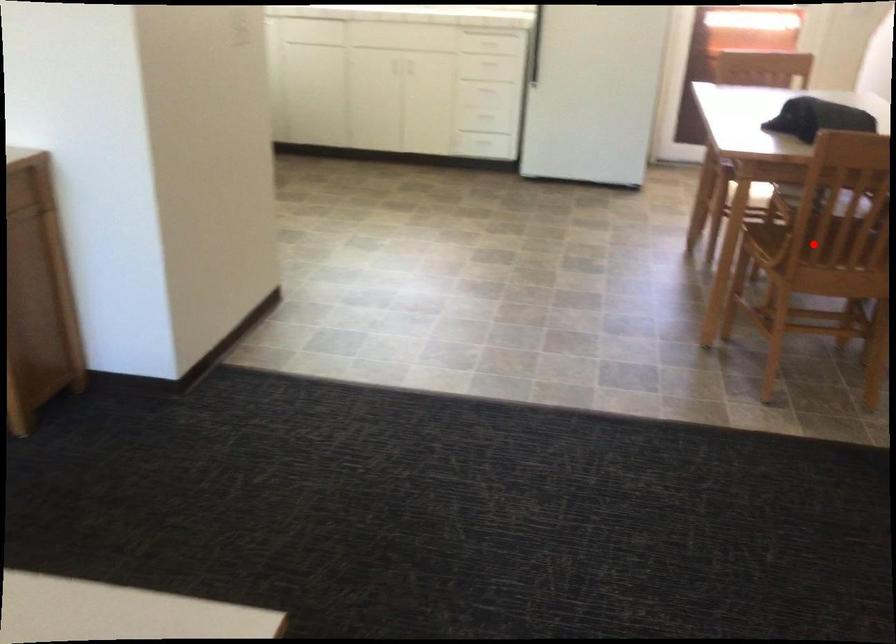
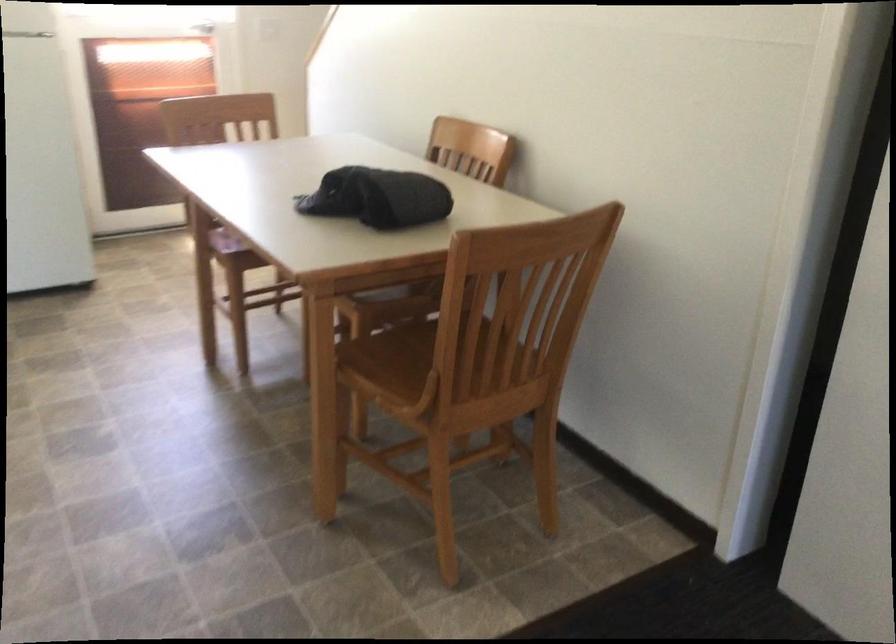
Question: A red point is marked in image1. In image2, is the corresponding 3D point closer to the camera or farther? Reply with the corresponding letter.

Choices:
 (A) The corresponding 3D point is closer.
 (B) The corresponding 3D point is farther.

Answer: (A)